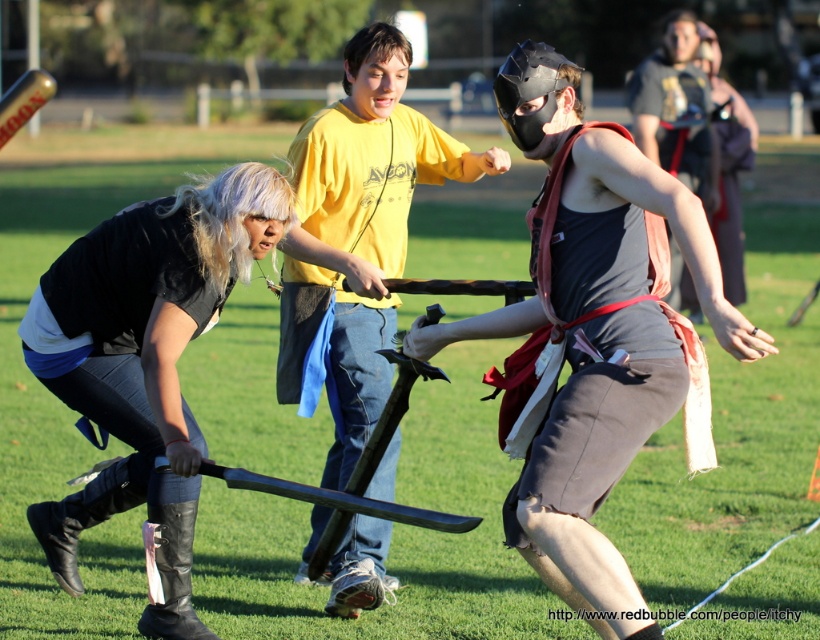
Question: Which object is the farthest from the black leather boots at lower left?

Choices:
 (A) matte black mask at center
 (B) matte black helmet at center
 (C) yellow t-shirt at center

Answer: (B)

Question: Does yellow t-shirt at center appear on the left side of matte black helmet at center?

Choices:
 (A) yes
 (B) no

Answer: (A)

Question: Which of the following is the closest to the observer?

Choices:
 (A) yellow t-shirt at center
 (B) black leather boots at lower left
 (C) matte black mask at center

Answer: (C)

Question: Which point is farther from the camera taking this photo?

Choices:
 (A) (577, 221)
 (B) (690, 177)

Answer: (B)

Question: In this image, where is matte black mask at center located relative to black leather boots at lower left?

Choices:
 (A) below
 (B) above

Answer: (B)

Question: Can you confirm if yellow t-shirt at center is thinner than matte black helmet at center?

Choices:
 (A) yes
 (B) no

Answer: (A)